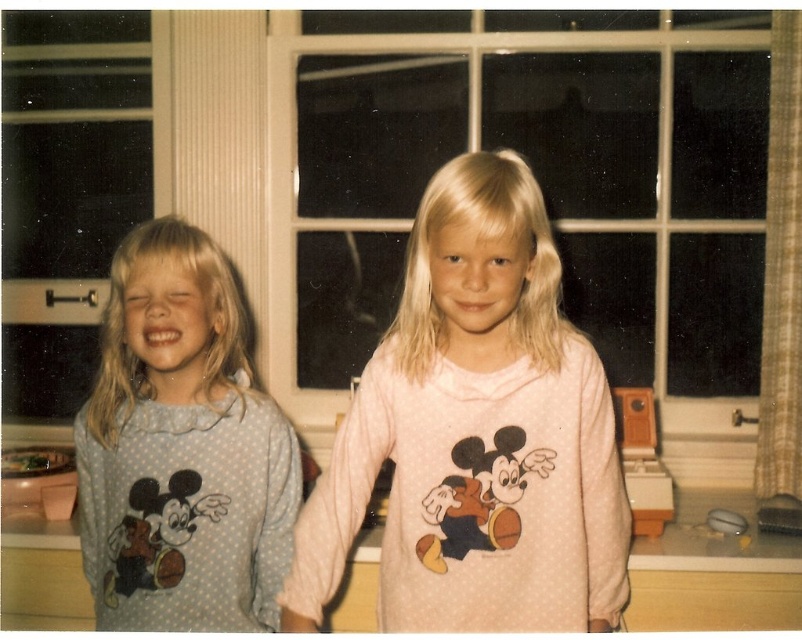
Is point (353, 397) farther from viewer compared to point (96, 611)?

No, it is not.

I want to click on pink soft fabric shirt at center, so click(476, 435).

Who is more distant from viewer, (x=735, y=385) or (x=347, y=520)?

Point (x=735, y=385)

Is clear glass window at center smaller than pink soft fabric shirt at center?

No, clear glass window at center is not smaller than pink soft fabric shirt at center.

Is point (270, 308) closer to viewer compared to point (557, 451)?

No, it is not.

Where is `clear glass window at center`? This screenshot has height=640, width=802. clear glass window at center is located at coordinates (541, 188).

Is clear glass window at center smaller than light blue dotted pajamas at left?

Actually, clear glass window at center might be larger than light blue dotted pajamas at left.

Between point (312, 289) and point (96, 496), which one is positioned behind?

Positioned behind is point (312, 289).

I want to click on clear glass window at center, so click(x=541, y=188).